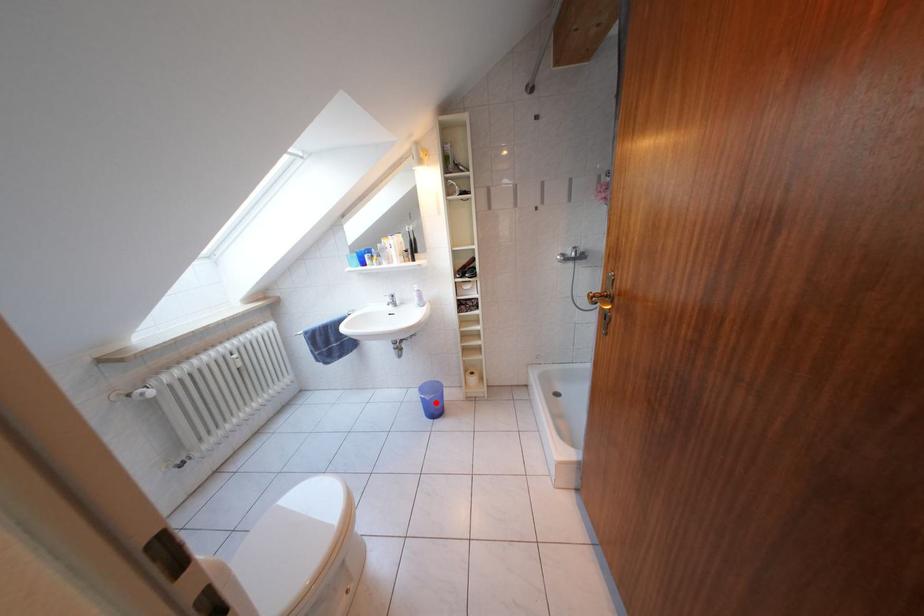
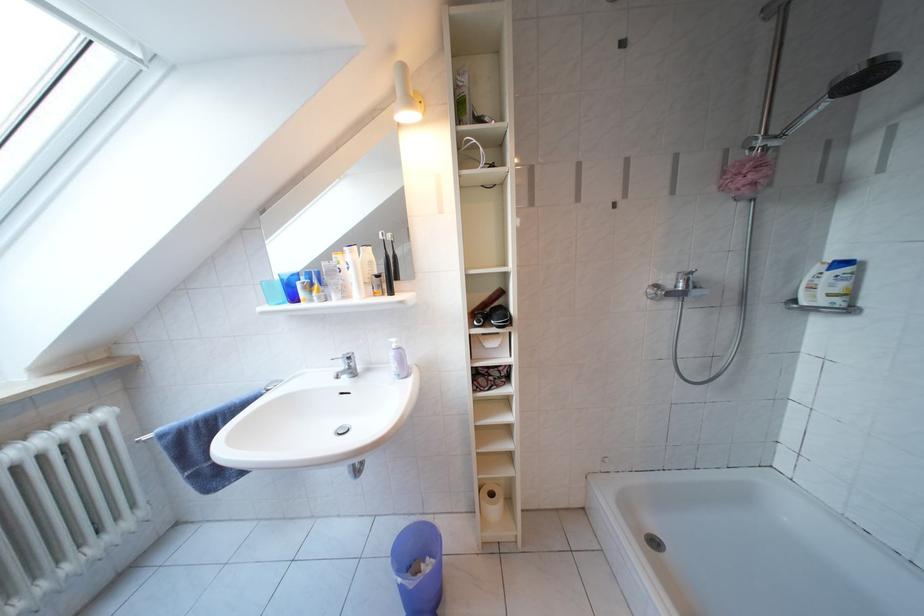
Question: A red point is marked in image1. In image2, is the corresponding 3D point closer to the camera or farther? Reply with the corresponding letter.

Choices:
 (A) The corresponding 3D point is closer.
 (B) The corresponding 3D point is farther.

Answer: (A)